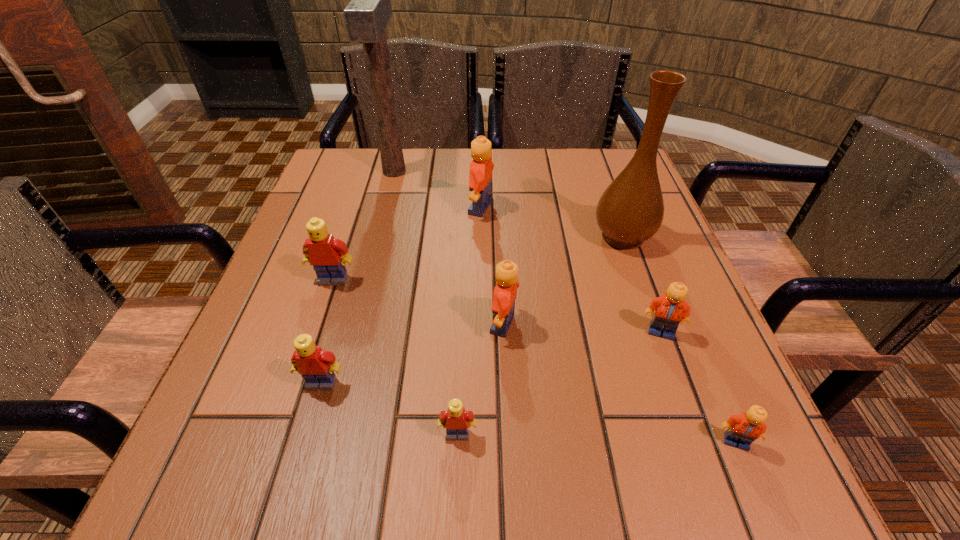
Where is `the third nearest object`? Image resolution: width=960 pixels, height=540 pixels. the third nearest object is located at coordinates (316, 366).

The height and width of the screenshot is (540, 960). Find the location of `the nearest orange Lego`. the nearest orange Lego is located at coordinates (743, 429).

At what (x,y) coordinates should I click in order to perform the action: click on the smallest yellow Lego. Please return your answer as a coordinate pair (x, y). This screenshot has height=540, width=960. Looking at the image, I should click on (455, 419).

In order to click on the nearest yellow Lego in this screenshot , I will do `click(455, 419)`.

What are the coordinates of `vacant space positioned on the left of the farthest object` in the screenshot? It's located at (325, 172).

I want to click on free space located on the front of the second tallest object, so click(x=663, y=352).

At what (x,y) coordinates should I click in order to perform the action: click on free point located on the front-facing side of the tallest Lego. Please return your answer as a coordinate pair (x, y). Looking at the image, I should click on (303, 208).

The width and height of the screenshot is (960, 540). What are the coordinates of `vacant space located on the front-facing side of the tallest Lego` in the screenshot? It's located at (396, 208).

Identify the location of vacant space situated on the front-facing side of the tallest Lego. The width and height of the screenshot is (960, 540). 371,208.

Identify the location of blank space located on the front-facing side of the second biggest orange Lego. This screenshot has width=960, height=540. (384, 325).